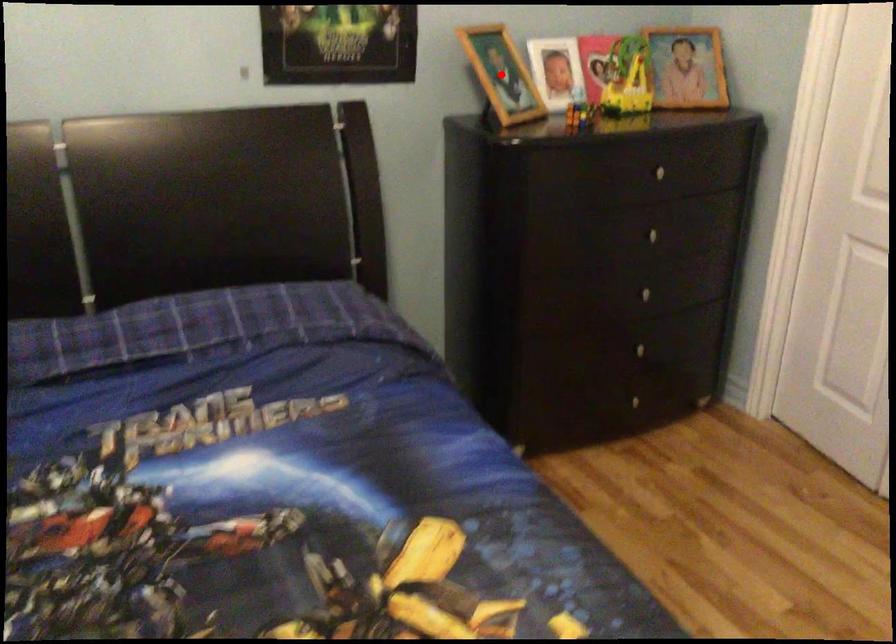
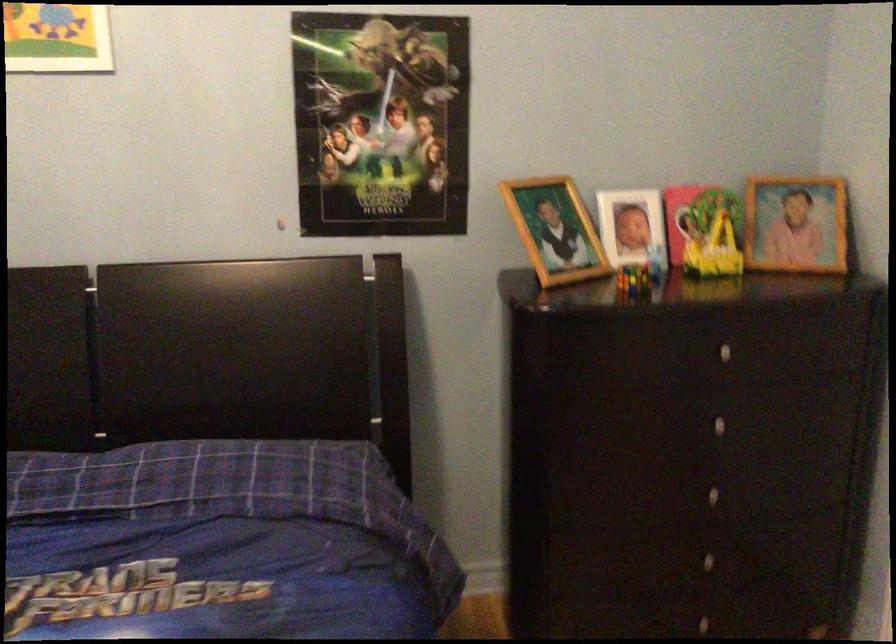
The point at the highlighted location is marked in the first image. Where is the corresponding point in the second image?

(555, 230)